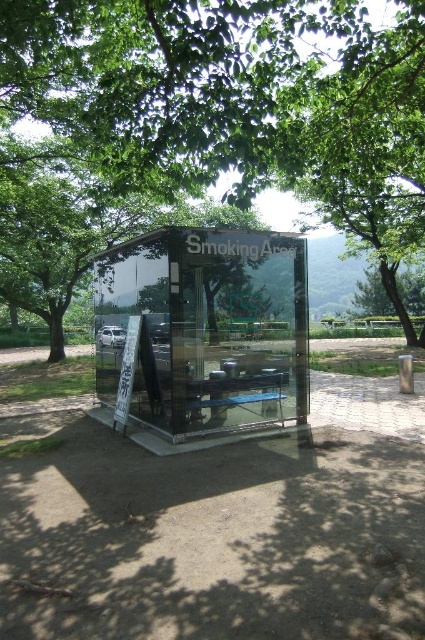
How far apart are green leafy tree at center and transparent glass smoking area at center?

A distance of 3.41 meters exists between green leafy tree at center and transparent glass smoking area at center.

Is green leafy tree at center below transparent glass smoking area at center?

Actually, green leafy tree at center is above transparent glass smoking area at center.

Is point (116, 108) less distant than point (288, 385)?

Yes.

Where is `green leafy tree at center`? The image size is (425, 640). green leafy tree at center is located at coordinates (226, 104).